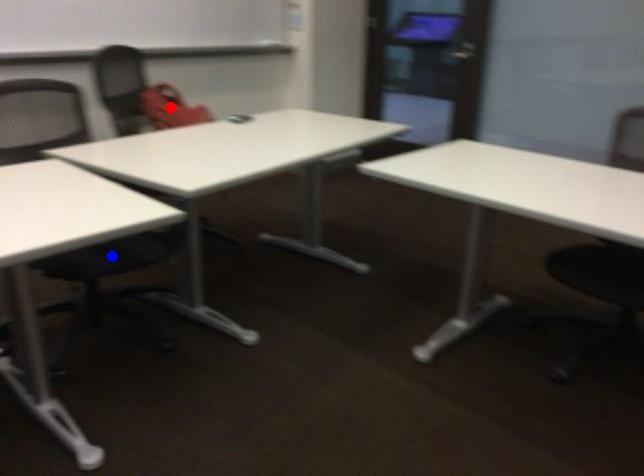
Question: Which of the two points in the image is closer to the camera?

Choices:
 (A) Blue point is closer.
 (B) Red point is closer.

Answer: (A)